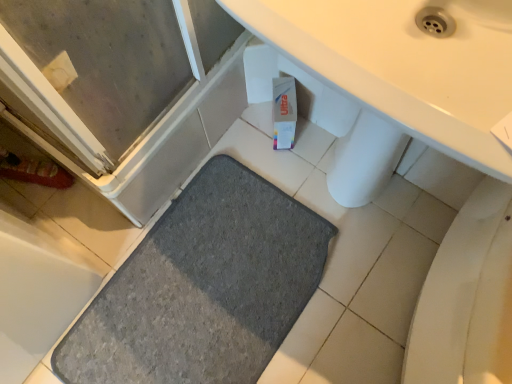
Question: Do you think gray rubber mat at lower left is within gray carpet at lower left, or outside of it?

Choices:
 (A) inside
 (B) outside

Answer: (B)

Question: Considering the positions of gray rubber mat at lower left and gray carpet at lower left in the image, is gray rubber mat at lower left wider or thinner than gray carpet at lower left?

Choices:
 (A) wide
 (B) thin

Answer: (B)

Question: Is point (19, 364) positioned closer to the camera than point (227, 314)?

Choices:
 (A) farther
 (B) closer

Answer: (B)

Question: Is gray carpet at lower left spatially inside gray rubber mat at lower left, or outside of it?

Choices:
 (A) inside
 (B) outside

Answer: (B)

Question: In the image, is gray carpet at lower left positioned in front of or behind gray rubber mat at lower left?

Choices:
 (A) front
 (B) behind

Answer: (B)

Question: Considering the positions of point (280, 226) and point (17, 317), is point (280, 226) closer or farther from the camera than point (17, 317)?

Choices:
 (A) closer
 (B) farther

Answer: (B)

Question: Considering the positions of gray carpet at lower left and gray rubber mat at lower left in the image, is gray carpet at lower left wider or thinner than gray rubber mat at lower left?

Choices:
 (A) thin
 (B) wide

Answer: (B)